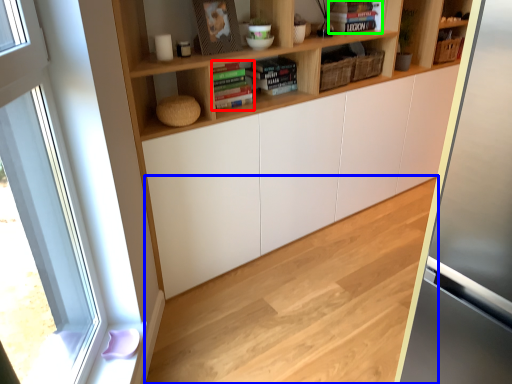
Question: Based on their relative distances, which object is farther from book (highlighted by a red box)? Choose from hardwood (highlighted by a blue box) and book (highlighted by a green box).

Choices:
 (A) hardwood
 (B) book

Answer: (A)